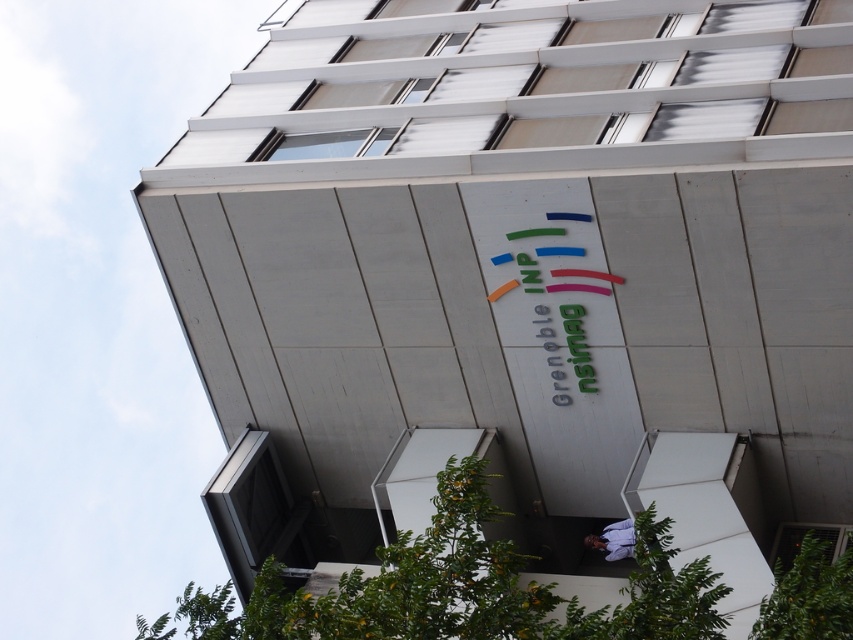
In the scene shown: Does glossy plastic sign at center have a lesser height compared to light blue shirt at lower center?

No, glossy plastic sign at center is not shorter than light blue shirt at lower center.

Is glossy plastic sign at center wider than light blue shirt at lower center?

Yes, glossy plastic sign at center is wider than light blue shirt at lower center.

Does point (547, 252) come in front of point (607, 557)?

Yes.

Locate an element on the screen. glossy plastic sign at center is located at coordinates (550, 291).